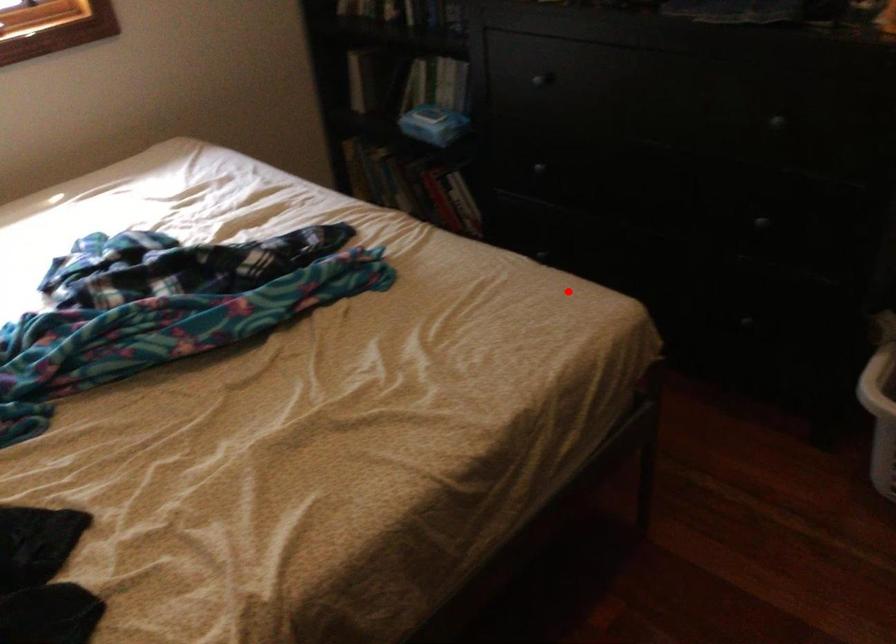
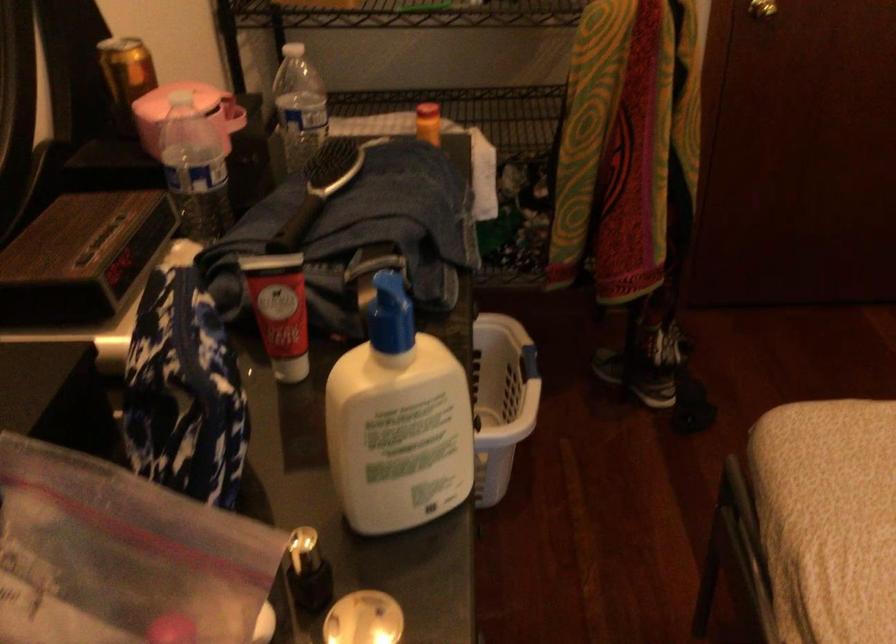
In the second image, find the point that corresponds to the highlighted location in the first image.

(828, 488)